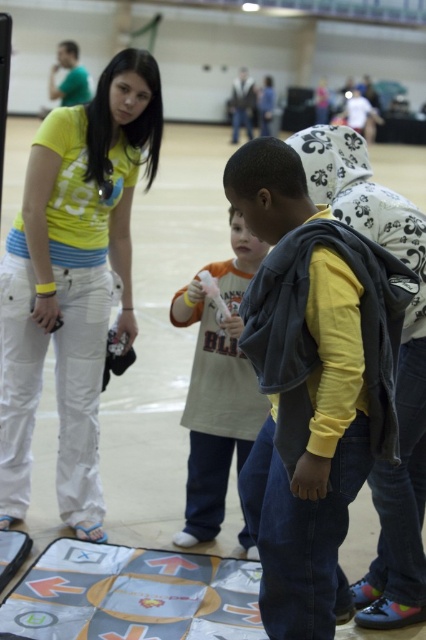
Who is shorter, gray fabric mat at lower center or orange cotton shirt at center?

With less height is gray fabric mat at lower center.

Is point (149, 614) farther from camera compared to point (218, 493)?

No, it is not.

What are the coordinates of `gray fabric mat at lower center` in the screenshot? It's located at (134, 595).

Does dark gray fleece vest at center appear on the right side of orange cotton shirt at center?

Indeed, dark gray fleece vest at center is positioned on the right side of orange cotton shirt at center.

Does dark gray fleece vest at center have a lesser height compared to orange cotton shirt at center?

In fact, dark gray fleece vest at center may be taller than orange cotton shirt at center.

Which is behind, point (307, 280) or point (206, 468)?

The point (206, 468) is behind.

Locate an element on the screen. This screenshot has height=640, width=426. dark gray fleece vest at center is located at coordinates [313, 465].

The width and height of the screenshot is (426, 640). Find the location of `dark gray fleece vest at center`. dark gray fleece vest at center is located at coordinates (313, 465).

This screenshot has width=426, height=640. I want to click on dark gray fleece vest at center, so click(x=313, y=465).